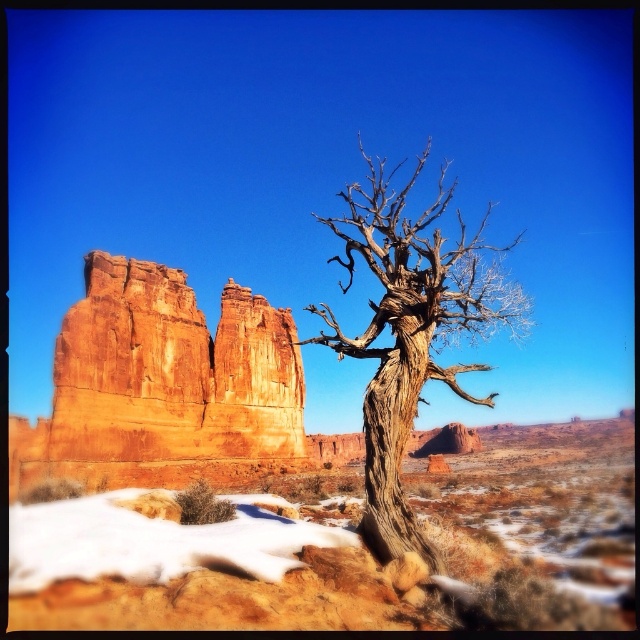
Question: Is rustic sandstone rock formation at left to the left of white powdery snow at lower left from the viewer's perspective?

Choices:
 (A) no
 (B) yes

Answer: (B)

Question: Where is rustic sandstone rock formation at left located in relation to grayish-brown bark tree at center in the image?

Choices:
 (A) above
 (B) below

Answer: (B)

Question: Does desert sandstone rock at center lie in front of rustic sandstone rock formation at left?

Choices:
 (A) no
 (B) yes

Answer: (B)

Question: Considering the real-world distances, which object is closest to the white powdery snow at lower left?

Choices:
 (A) desert sandstone rock at center
 (B) grayish-brown bark tree at center
 (C) rustic sandstone rock formation at left

Answer: (A)

Question: Considering the real-world distances, which object is farthest from the grayish-brown bark tree at center?

Choices:
 (A) desert sandstone rock at center
 (B) white powdery snow at lower left
 (C) rustic sandstone rock formation at left

Answer: (B)

Question: Which object is the farthest from the rustic sandstone rock formation at left?

Choices:
 (A) white powdery snow at lower left
 (B) grayish-brown bark tree at center
 (C) desert sandstone rock at center

Answer: (B)